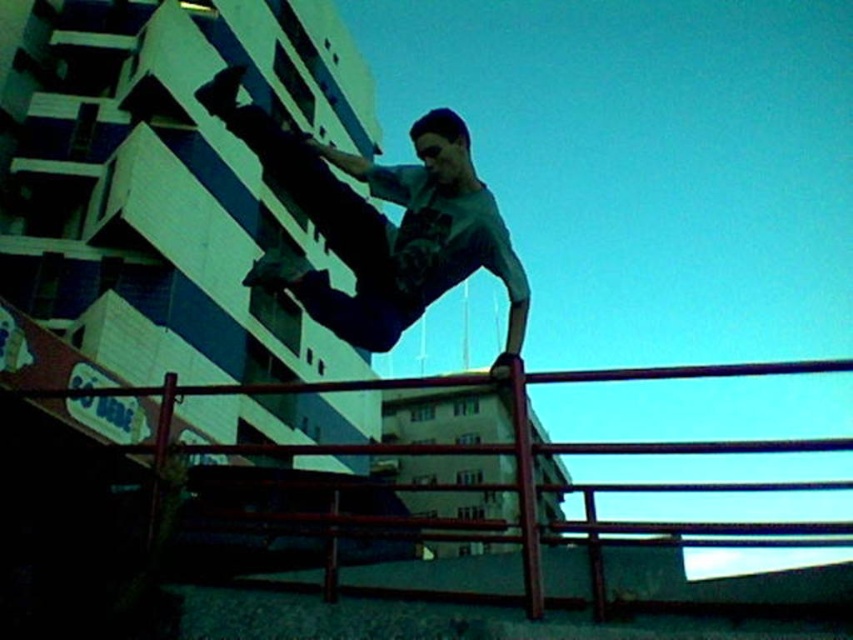
Does matte gray shirt at center have a greater height compared to smooth metal rail at center?

No, matte gray shirt at center is not taller than smooth metal rail at center.

Identify the location of matte gray shirt at center. (380, 224).